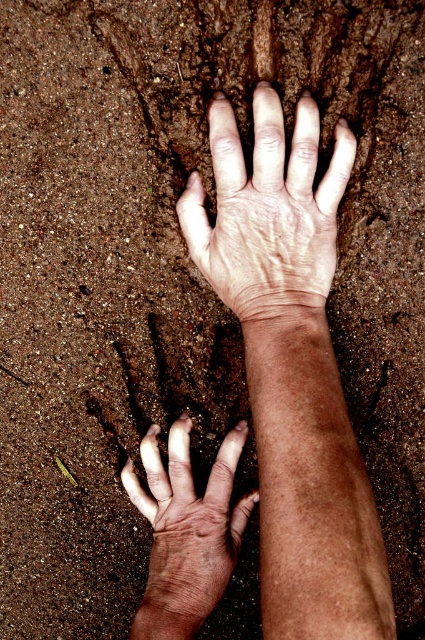
You are a dermatologist examining two patients with dry skin. The first patient has a dry skin hand at upper center, and the second has a dry skin hand at lower left. Based on the image, which hand has a wider palm? Please refer to the spatial details provided in the scene.

The dry skin hand at upper center might be wider than dry skin hand at lower left according to the spatial details provided.

Based on the photo, you are a photographer trying to capture the texture of the dry skin hand at upper center in the image. To ensure the best lighting, you need to position your camera so that the light hits the point at coordinates point [268,208]. Based on the scene description, can you confirm if this point is located on the dry skin hand at upper center?

Yes, the point [268,208] is on the dry skin hand at upper center, so positioning the camera to light this area will highlight the texture of the dry skin hand at upper center.

You are a photographer trying to capture the texture of the hands in the image. Which hand, the dry skin hand at upper center or the dry skin hand at lower left, would show more detailed texture due to its position?

Answer: The dry skin hand at upper center would show more detailed texture because it is closer to the viewer than the dry skin hand at lower left.